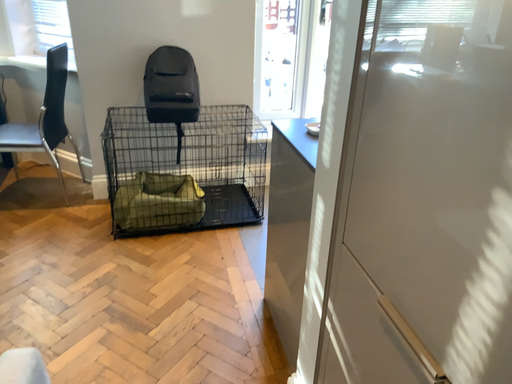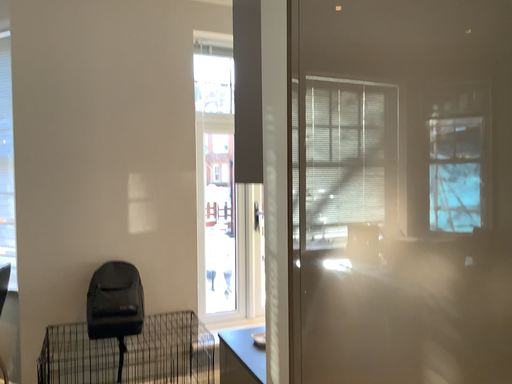
Question: Which way did the camera rotate in the video?

Choices:
 (A) rotated upward
 (B) rotated downward

Answer: (A)